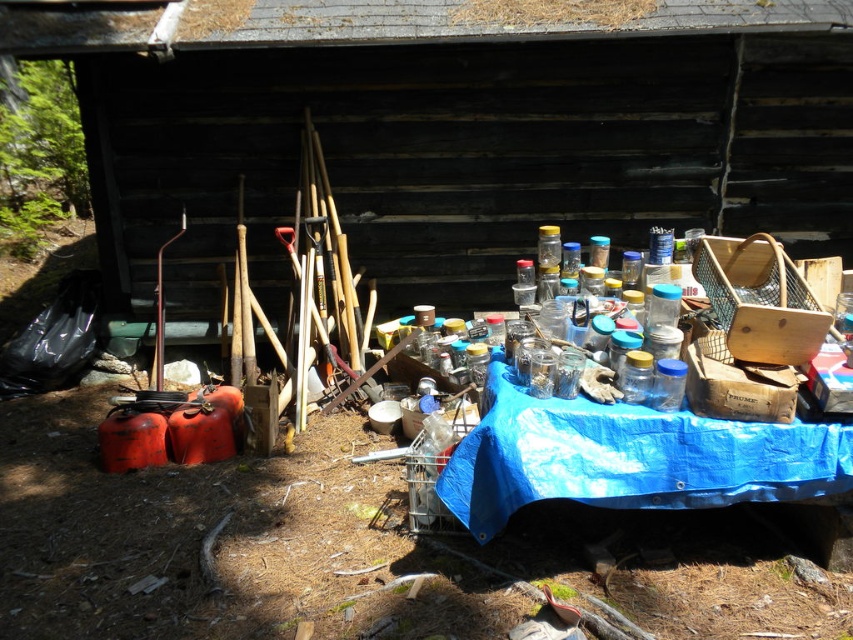
Question: Is transparent plastic containers at center wider than blue tarpaulin table at center?

Choices:
 (A) no
 (B) yes

Answer: (B)

Question: Which object appears closest to the camera in this image?

Choices:
 (A) blue tarpaulin table at center
 (B) transparent plastic containers at center

Answer: (A)

Question: Which of the following is the farthest from the observer?

Choices:
 (A) (808, 451)
 (B) (219, 257)

Answer: (B)

Question: Can you confirm if transparent plastic containers at center is bigger than blue tarpaulin table at center?

Choices:
 (A) yes
 (B) no

Answer: (A)

Question: Is transparent plastic containers at center closer to camera compared to blue tarpaulin table at center?

Choices:
 (A) yes
 (B) no

Answer: (B)